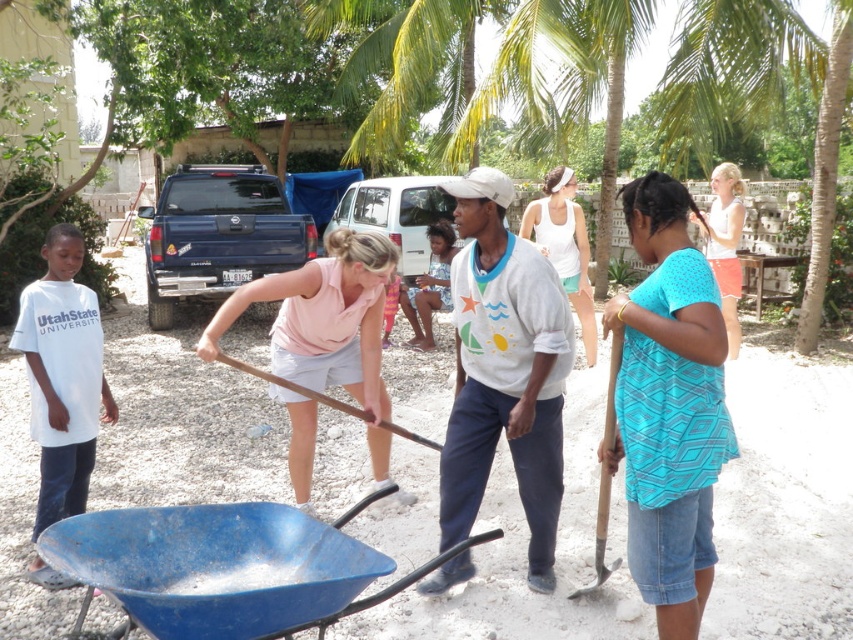
You are a GUI agent. You are given a task and a screenshot of the screen. Output one action in this format:
    pyautogui.click(x=<x>, y=<y>)
    Task: Click on the white tank top at upper right
    This screenshot has width=853, height=640.
    Given the screenshot: What is the action you would take?
    [x=724, y=244]

Who is more distant from viewer, (735,234) or (605,451)?

The point (735,234) is behind.

This screenshot has height=640, width=853. What do you see at coordinates (724, 244) in the screenshot?
I see `white tank top at upper right` at bounding box center [724, 244].

Identify the location of white tank top at upper right. Image resolution: width=853 pixels, height=640 pixels. (724, 244).

Who is higher up, blue plastic cart at lower left or pink fabric shirt at center?

pink fabric shirt at center

Is point (170, 508) positioned after point (285, 355)?

No, it is in front of (285, 355).

Is point (109, 556) more distant than point (389, 259)?

No, (109, 556) is in front of (389, 259).

You are a GUI agent. You are given a task and a screenshot of the screen. Output one action in this format:
    pyautogui.click(x=<x>, y=<y>)
    Task: Click on the blue plastic cart at lower left
    The height and width of the screenshot is (640, 853).
    Given the screenshot: What is the action you would take?
    pyautogui.click(x=225, y=566)

Based on the photo, is white tank top at center thinner than white tank top at upper right?

Incorrect, white tank top at center's width is not less than white tank top at upper right's.

Which is behind, point (585, 250) or point (728, 177)?

The point (728, 177) is behind.

Is point (553, 234) behind point (732, 212)?

No, it is not.

Where is `white tank top at center`? The width and height of the screenshot is (853, 640). white tank top at center is located at coordinates (564, 246).